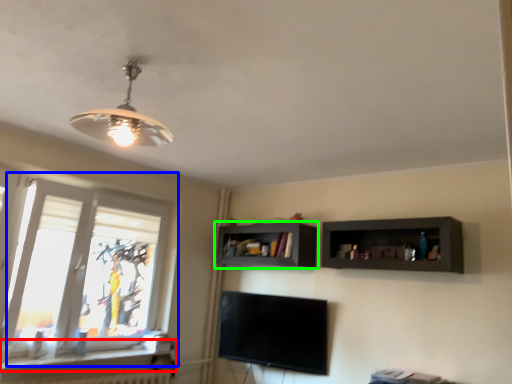
Question: Which is nearer to the window sill (highlighted by a red box)? window (highlighted by a blue box) or shelf (highlighted by a green box).

Choices:
 (A) window
 (B) shelf

Answer: (A)